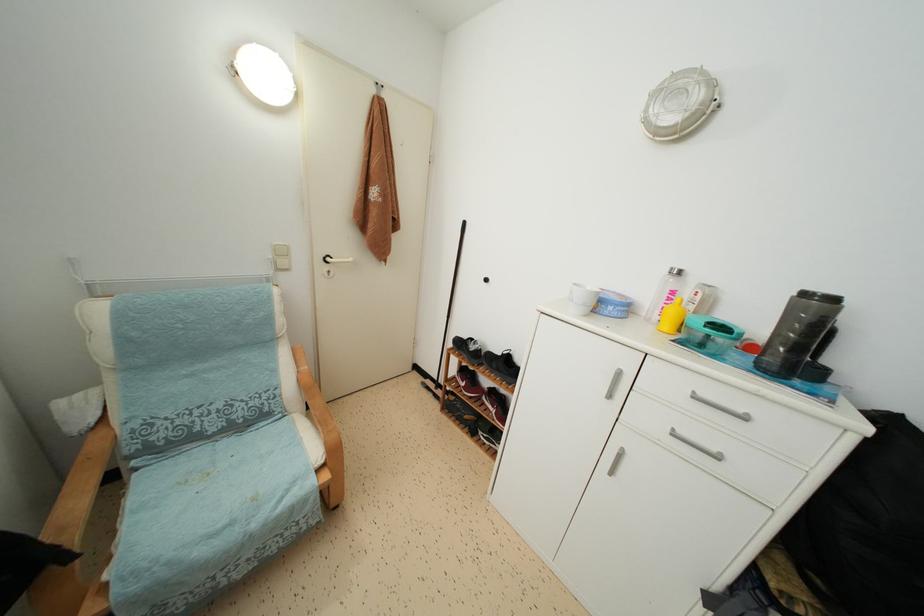
Find the location of a particular element. The height and width of the screenshot is (616, 924). black water bottle is located at coordinates (796, 333).